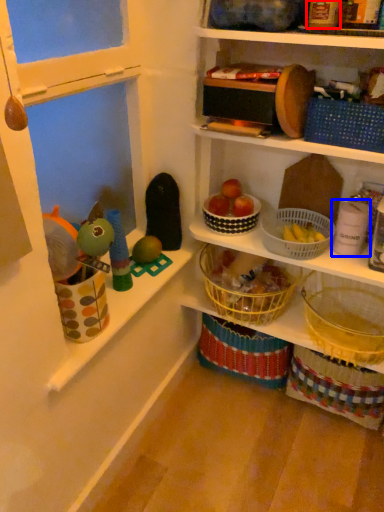
Question: Among these objects, which one is farthest to the camera, toy (highlighted by a red box) or toy (highlighted by a blue box)?

Choices:
 (A) toy
 (B) toy

Answer: (B)